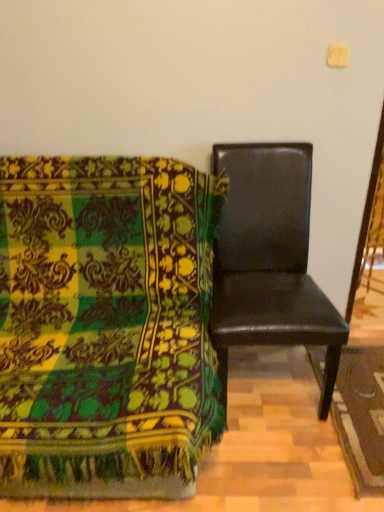
Where is `black leather chair at right, marked as the 2th chair in a right-to-left arrangement`? The image size is (384, 512). black leather chair at right, marked as the 2th chair in a right-to-left arrangement is located at coordinates (106, 326).

This screenshot has height=512, width=384. Describe the element at coordinates (106, 326) in the screenshot. I see `black leather chair at right, marked as the 2th chair in a right-to-left arrangement` at that location.

Image resolution: width=384 pixels, height=512 pixels. What are the coordinates of `black leather chair at right, the 1th chair in the right-to-left sequence` in the screenshot? It's located at [x=269, y=259].

Describe the element at coordinates (269, 259) in the screenshot. I see `black leather chair at right, the 1th chair in the right-to-left sequence` at that location.

Find the location of a particular element. The width and height of the screenshot is (384, 512). black leather chair at right, marked as the 2th chair in a right-to-left arrangement is located at coordinates point(106,326).

Based on their positions, is black leather chair at right, the 2th chair when ordered from left to right, located to the left or right of black leather chair at right, marked as the 1th chair in a left-to-right arrangement?

Clearly, black leather chair at right, the 2th chair when ordered from left to right, is on the right of black leather chair at right, marked as the 1th chair in a left-to-right arrangement, in the image.

Which object is closer to the camera, black leather chair at right, the 2th chair when ordered from left to right, or black leather chair at right, marked as the 2th chair in a right-to-left arrangement?

Positioned in front is black leather chair at right, marked as the 2th chair in a right-to-left arrangement.

Which point is more forward, (262, 294) or (202, 200)?

Positioned in front is point (202, 200).

From the image's perspective, between black leather chair at right, the 2th chair when ordered from left to right, and black leather chair at right, marked as the 1th chair in a left-to-right arrangement, who is located below?

black leather chair at right, marked as the 1th chair in a left-to-right arrangement, from the image's perspective.

From a real-world perspective, is black leather chair at right, the 1th chair in the right-to-left sequence, positioned under black leather chair at right, marked as the 2th chair in a right-to-left arrangement, based on gravity?

No, from a real-world perspective, black leather chair at right, the 1th chair in the right-to-left sequence, is not beneath black leather chair at right, marked as the 2th chair in a right-to-left arrangement.

Looking at their sizes, would you say black leather chair at right, the 2th chair when ordered from left to right, is wider or thinner than black leather chair at right, marked as the 1th chair in a left-to-right arrangement?

In the image, black leather chair at right, the 2th chair when ordered from left to right, appears to be more narrow than black leather chair at right, marked as the 1th chair in a left-to-right arrangement.

Does black leather chair at right, the 2th chair when ordered from left to right, have a greater height compared to black leather chair at right, marked as the 2th chair in a right-to-left arrangement?

Yes.

Considering the relative sizes of black leather chair at right, the 2th chair when ordered from left to right, and black leather chair at right, marked as the 1th chair in a left-to-right arrangement, in the image provided, is black leather chair at right, the 2th chair when ordered from left to right, smaller than black leather chair at right, marked as the 1th chair in a left-to-right arrangement,?

Indeed, black leather chair at right, the 2th chair when ordered from left to right, has a smaller size compared to black leather chair at right, marked as the 1th chair in a left-to-right arrangement.

Can black leather chair at right, marked as the 2th chair in a right-to-left arrangement, be found inside black leather chair at right, the 1th chair in the right-to-left sequence?

No, black leather chair at right, marked as the 2th chair in a right-to-left arrangement, is not inside black leather chair at right, the 1th chair in the right-to-left sequence.

Is black leather chair at right, the 2th chair when ordered from left to right, next to black leather chair at right, marked as the 1th chair in a left-to-right arrangement, and touching it?

black leather chair at right, the 2th chair when ordered from left to right, and black leather chair at right, marked as the 1th chair in a left-to-right arrangement, are clearly separated.

Is black leather chair at right, the 1th chair in the right-to-left sequence, facing towards black leather chair at right, marked as the 2th chair in a right-to-left arrangement?

No, black leather chair at right, the 1th chair in the right-to-left sequence, is not oriented towards black leather chair at right, marked as the 2th chair in a right-to-left arrangement.

This screenshot has height=512, width=384. I want to click on chair that appears behind the black leather chair at right, marked as the 2th chair in a right-to-left arrangement, so click(269, 259).

Does black leather chair at right, marked as the 1th chair in a left-to-right arrangement, appear on the right side of black leather chair at right, the 1th chair in the right-to-left sequence?

In fact, black leather chair at right, marked as the 1th chair in a left-to-right arrangement, is to the left of black leather chair at right, the 1th chair in the right-to-left sequence.

Which is in front, black leather chair at right, marked as the 2th chair in a right-to-left arrangement, or black leather chair at right, the 1th chair in the right-to-left sequence?

black leather chair at right, marked as the 2th chair in a right-to-left arrangement, is in front.

Considering the points (185, 229) and (260, 323), which point is in front, point (185, 229) or point (260, 323)?

The point (260, 323) is closer to the camera.

From the image's perspective, is black leather chair at right, marked as the 1th chair in a left-to-right arrangement, positioned above or below black leather chair at right, the 1th chair in the right-to-left sequence?

From the image's perspective, black leather chair at right, marked as the 1th chair in a left-to-right arrangement, appears below black leather chair at right, the 1th chair in the right-to-left sequence.

From the picture: From a real-world perspective, between black leather chair at right, marked as the 2th chair in a right-to-left arrangement, and black leather chair at right, the 2th chair when ordered from left to right, who is vertically lower?

black leather chair at right, marked as the 2th chair in a right-to-left arrangement.

In the scene shown: Considering the relative sizes of black leather chair at right, marked as the 2th chair in a right-to-left arrangement, and black leather chair at right, the 1th chair in the right-to-left sequence, in the image provided, is black leather chair at right, marked as the 2th chair in a right-to-left arrangement, thinner than black leather chair at right, the 1th chair in the right-to-left sequence,?

No, black leather chair at right, marked as the 2th chair in a right-to-left arrangement, is not thinner than black leather chair at right, the 1th chair in the right-to-left sequence.

Who is taller, black leather chair at right, marked as the 1th chair in a left-to-right arrangement, or black leather chair at right, the 2th chair when ordered from left to right?

black leather chair at right, the 2th chair when ordered from left to right, is taller.

Based on the photo, which of these two, black leather chair at right, marked as the 2th chair in a right-to-left arrangement, or black leather chair at right, the 1th chair in the right-to-left sequence, is smaller?

black leather chair at right, the 1th chair in the right-to-left sequence.

Would you say black leather chair at right, marked as the 2th chair in a right-to-left arrangement, is outside black leather chair at right, the 1th chair in the right-to-left sequence?

Absolutely, black leather chair at right, marked as the 2th chair in a right-to-left arrangement, is external to black leather chair at right, the 1th chair in the right-to-left sequence.

Is black leather chair at right, marked as the 1th chair in a left-to-right arrangement, positioned far away from black leather chair at right, the 1th chair in the right-to-left sequence?

No, black leather chair at right, marked as the 1th chair in a left-to-right arrangement, is not far away from black leather chair at right, the 1th chair in the right-to-left sequence.

Could you tell me if black leather chair at right, marked as the 1th chair in a left-to-right arrangement, is turned towards black leather chair at right, the 2th chair when ordered from left to right?

No, black leather chair at right, marked as the 1th chair in a left-to-right arrangement, is not aimed at black leather chair at right, the 2th chair when ordered from left to right.

The height and width of the screenshot is (512, 384). In order to click on chair to the left of black leather chair at right, the 2th chair when ordered from left to right in this screenshot , I will do `click(106, 326)`.

Where is `chair that is behind the black leather chair at right, marked as the 1th chair in a left-to-right arrangement`? This screenshot has width=384, height=512. chair that is behind the black leather chair at right, marked as the 1th chair in a left-to-right arrangement is located at coordinates (269, 259).

The height and width of the screenshot is (512, 384). What are the coordinates of `chair below the black leather chair at right, the 2th chair when ordered from left to right (from a real-world perspective)` in the screenshot? It's located at (106, 326).